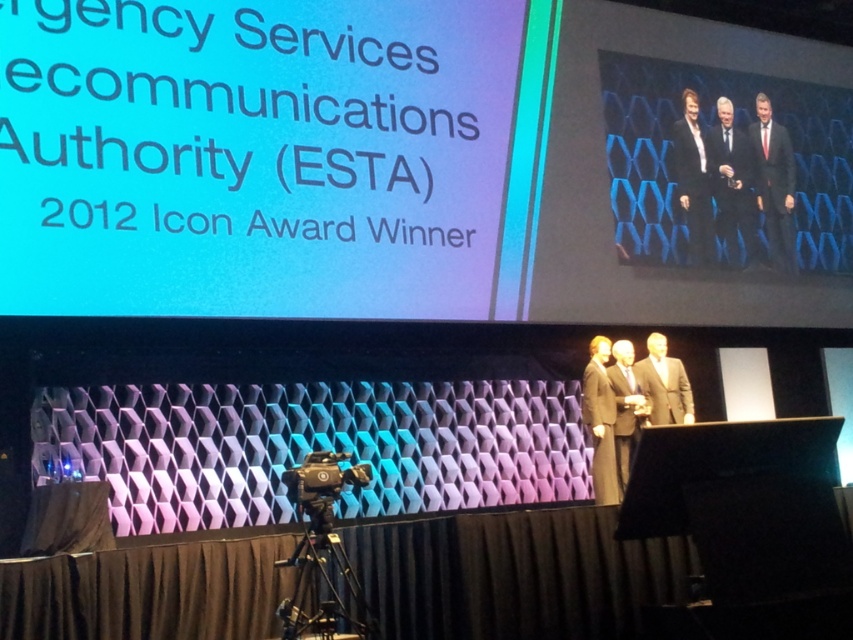
Question: Is satin gold suit at center smaller than satin black suit at center?

Choices:
 (A) no
 (B) yes

Answer: (A)

Question: Is matte black text at upper left to the left of satin black suit at center from the viewer's perspective?

Choices:
 (A) yes
 (B) no

Answer: (A)

Question: Which of the following is the farthest from the observer?

Choices:
 (A) (610, 499)
 (B) (784, 164)
 (C) (300, 563)

Answer: (B)

Question: Which object is closer to the camera taking this photo?

Choices:
 (A) black suit at upper right
 (B) black matte tripod at lower center
 (C) satin black suit at center
 (D) dark suit at center

Answer: (B)

Question: Can you confirm if black suit at upper right is positioned below black suit at center?

Choices:
 (A) yes
 (B) no

Answer: (A)

Question: Considering the real-world distances, which object is farthest from the dark suit at center?

Choices:
 (A) satin gold suit at center
 (B) black suit at upper right
 (C) black matte tripod at lower center

Answer: (B)